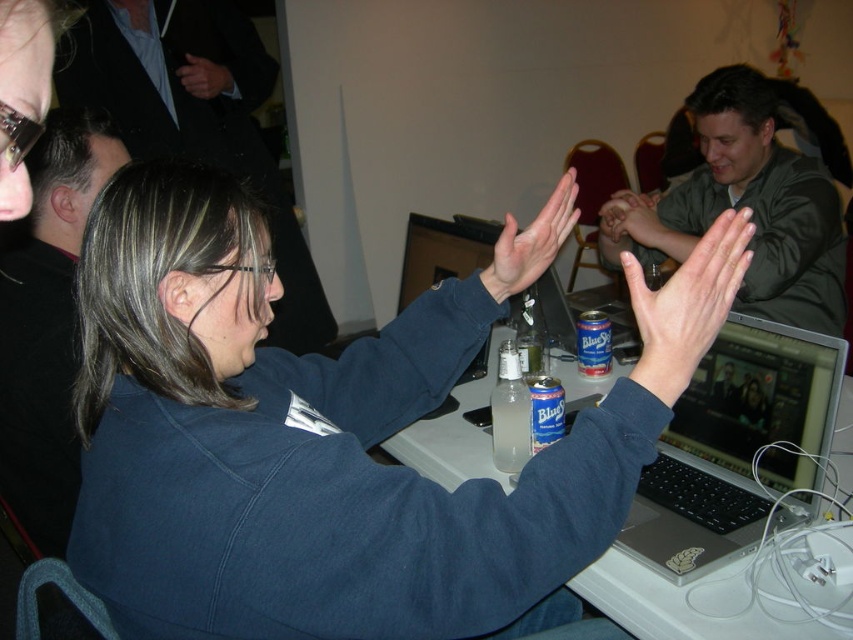
You are standing in front of the table where the person is seated. There are two points marked on the table surface. The first point is at coordinates point (822, 220) and the second point is at point (653, 234). Which of these two points is closer to you?

Point (822, 220) is closer to the camera than point (653, 234), so the first point is closer to you.

You are a photographer taking a picture of the blue matte jacket at center and the white matte hand at upper center. Which object will appear bigger in the photo?

The blue matte jacket at center will appear bigger in the photo because it is larger in size than the white matte hand at upper center.

Based on the photo, you are standing behind the person in the image and want to hand them a document without touching them. Which object, the blue matte jacket at center or the white matte hand at upper center, should you aim for to place the document closest to the person?

The blue matte jacket at center is in front of the white matte hand at upper center, so placing the document near the blue matte jacket at center would position it closer to the person.